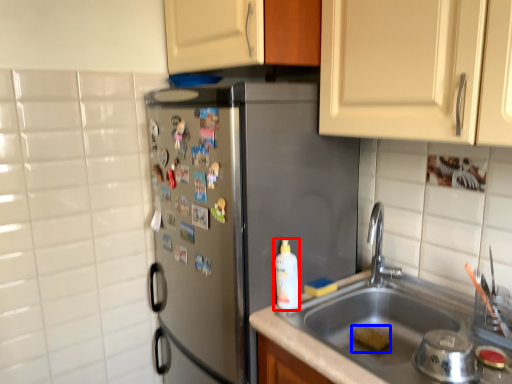
Question: Which point is closer to the camera, cleaning product (highlighted by a red box) or food (highlighted by a blue box)?

Choices:
 (A) cleaning product
 (B) food

Answer: (A)